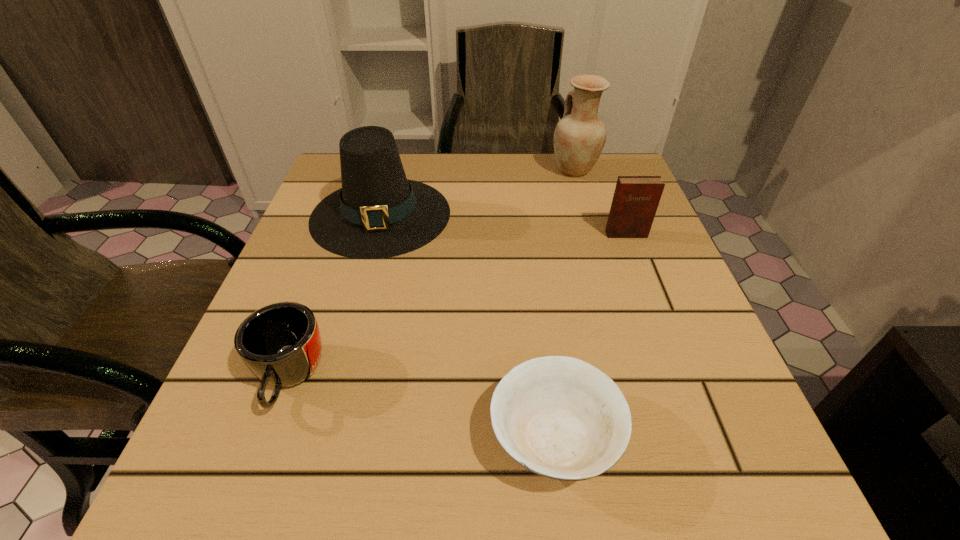
You are a GUI agent. You are given a task and a screenshot of the screen. Output one action in this format:
    pyautogui.click(x=<x>, y=<y>)
    Task: Click on the pottery that is at the far edge
    
    Given the screenshot: What is the action you would take?
    pyautogui.click(x=579, y=137)

This screenshot has height=540, width=960. Identify the location of hat at the far edge. (378, 213).

This screenshot has width=960, height=540. I want to click on object that is at the near edge, so click(559, 417).

Find the location of `hat present at the left edge`. hat present at the left edge is located at coordinates (378, 213).

In order to click on mug situated at the left edge in this screenshot , I will do (280, 343).

I want to click on pottery located in the right edge section of the desktop, so pyautogui.click(x=579, y=137).

You are a GUI agent. You are given a task and a screenshot of the screen. Output one action in this format:
    pyautogui.click(x=<x>, y=<y>)
    Task: Click on the diary positioned at the right edge
    
    Given the screenshot: What is the action you would take?
    pyautogui.click(x=636, y=198)

Where is `object that is at the far left corner`? The width and height of the screenshot is (960, 540). object that is at the far left corner is located at coordinates (378, 213).

At what (x,y) coordinates should I click in order to perform the action: click on object that is positioned at the far right corner. Please return your answer as a coordinate pair (x, y). This screenshot has height=540, width=960. Looking at the image, I should click on (579, 137).

Identify the location of free spot at the far edge of the desktop. (546, 160).